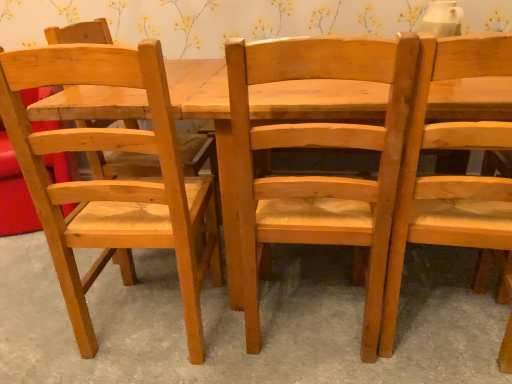
Identify the location of free space underneath natural wood chair at center, marked as the second chair in a right-to-left arrangement (from a real-world perspective). The width and height of the screenshot is (512, 384). coord(308,317).